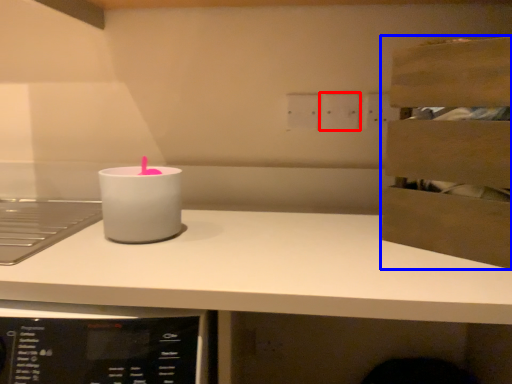
Question: Which object is closer to the camera taking this photo, electric outlet (highlighted by a red box) or cabinetry (highlighted by a blue box)?

Choices:
 (A) electric outlet
 (B) cabinetry

Answer: (B)